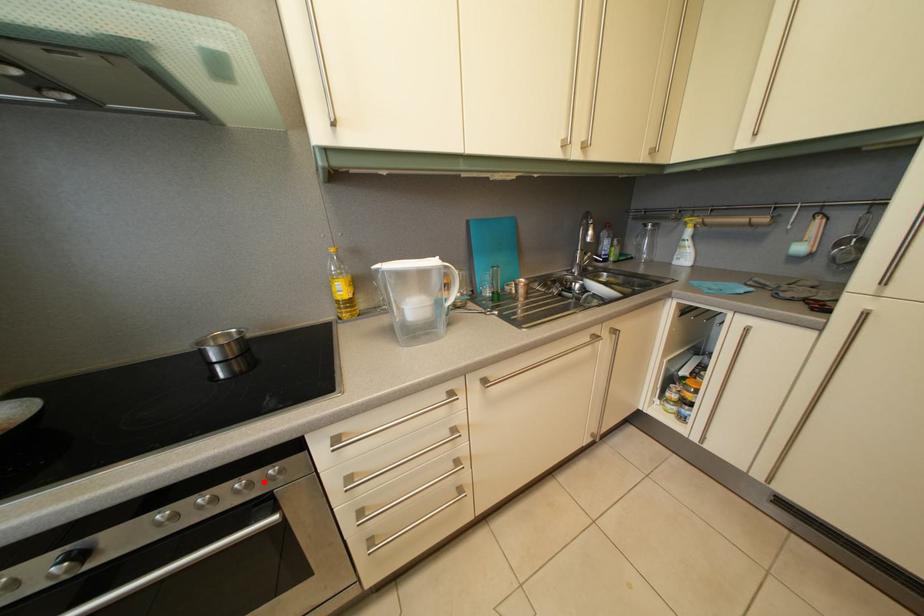
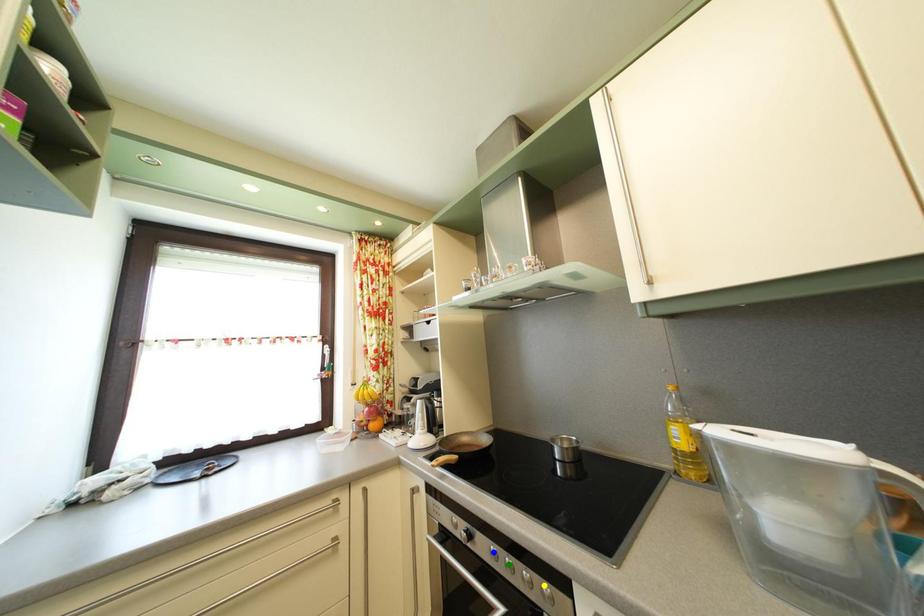
Question: I am providing you with two images of the same scene from different viewpoints. A red point is marked on the first image. You are given multiple points on the second image. In image 2, which mark is for the same physical point as the one in image 1?

Choices:
 (A) yellow point
 (B) green point
 (C) blue point

Answer: (A)